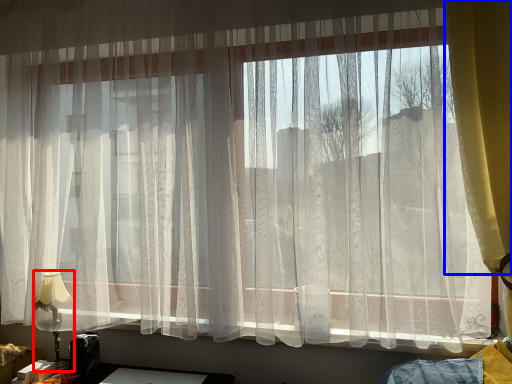
Question: Which object appears farthest to the camera in this image, table lamp (highlighted by a red box) or curtain (highlighted by a blue box)?

Choices:
 (A) table lamp
 (B) curtain

Answer: (A)